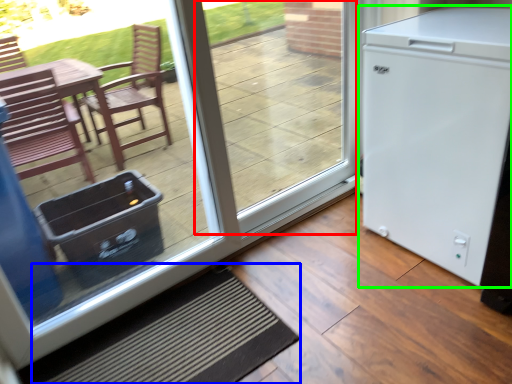
Question: Which object is the farthest from window (highlighted by a red box)? Choose among these: doormat (highlighted by a blue box) or refrigerator (highlighted by a green box).

Choices:
 (A) doormat
 (B) refrigerator

Answer: (A)